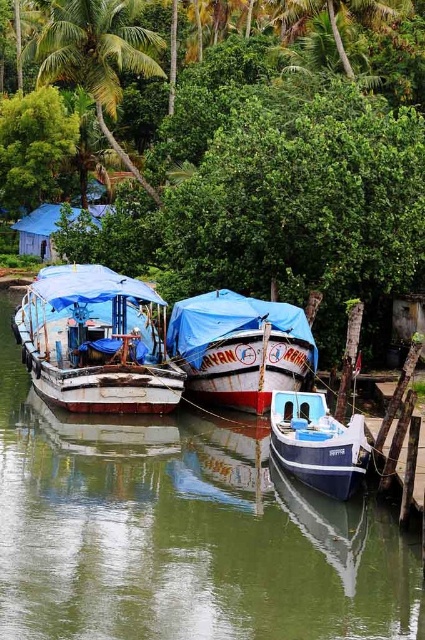
You are a tourist standing at the riverside and want to take a photo of the blue glossy boat at center with the green leafy tree at upper center in the background. Based on their positions, which object should be placed to the left in your photo composition?

The green leafy tree at upper center should be placed to the left of the blue glossy boat at center in your photo composition because the green leafy tree at upper center is positioned on the left side of blue glossy boat at center.

You are standing at the riverbank and want to locate two specific points in the scene. The first point is at coordinates point [345,595] and the second is at point [25,216]. Which point is closer to you?

Point [345,595] is closer to the viewer than point [25,216].